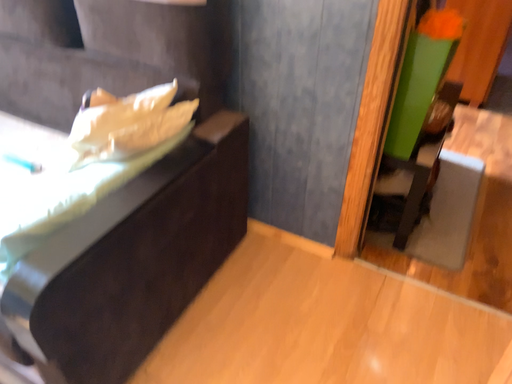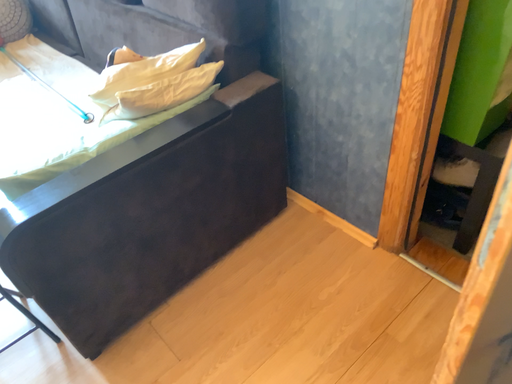
Question: How did the camera likely rotate when shooting the video?

Choices:
 (A) rotated left
 (B) rotated right

Answer: (A)